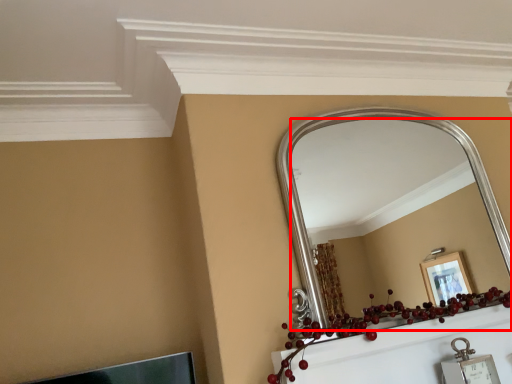
Question: From the image's perspective, where is mirror (annotated by the red box) located in relation to christmas decoration in the image?

Choices:
 (A) above
 (B) below

Answer: (A)